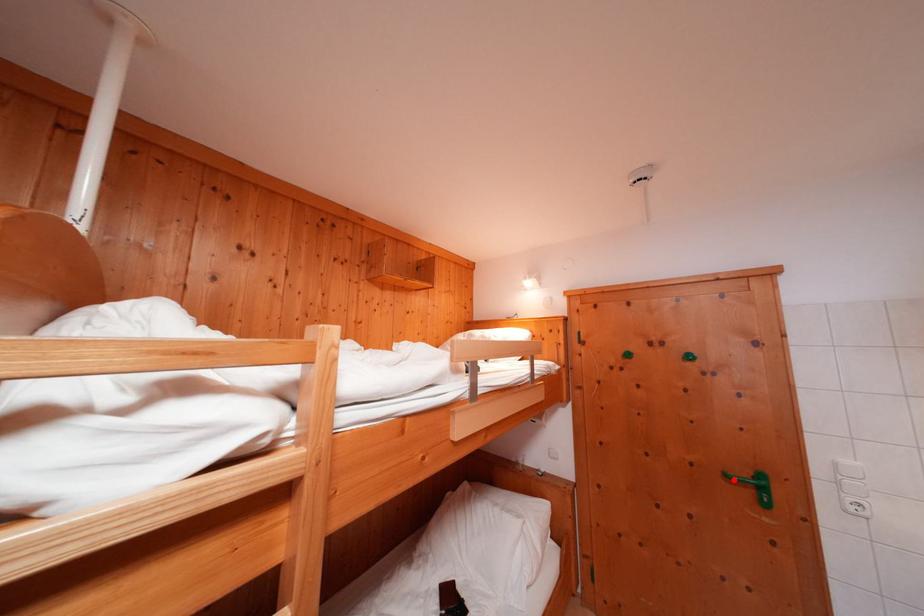
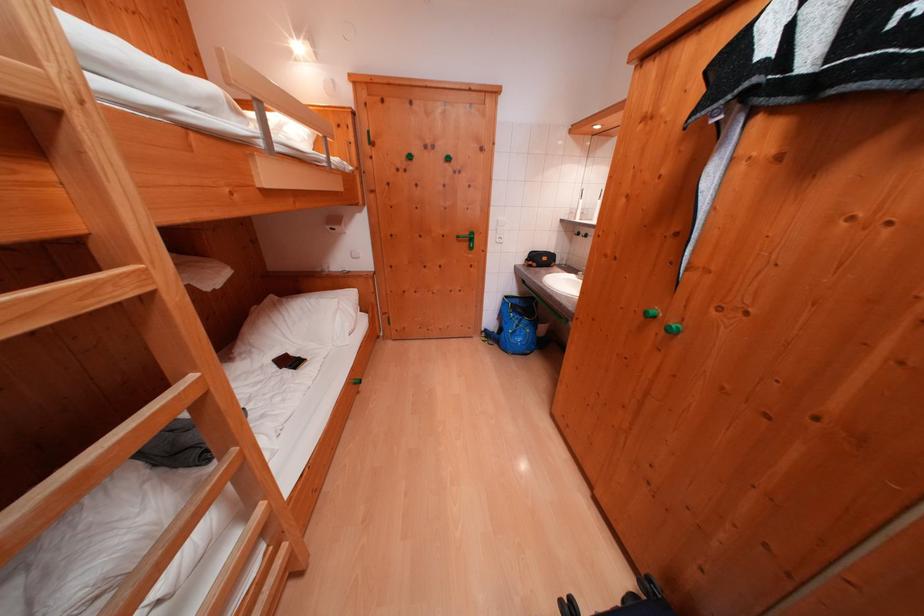
Where in the second image is the point corresponding to the highlighted location from the first image?

(466, 241)